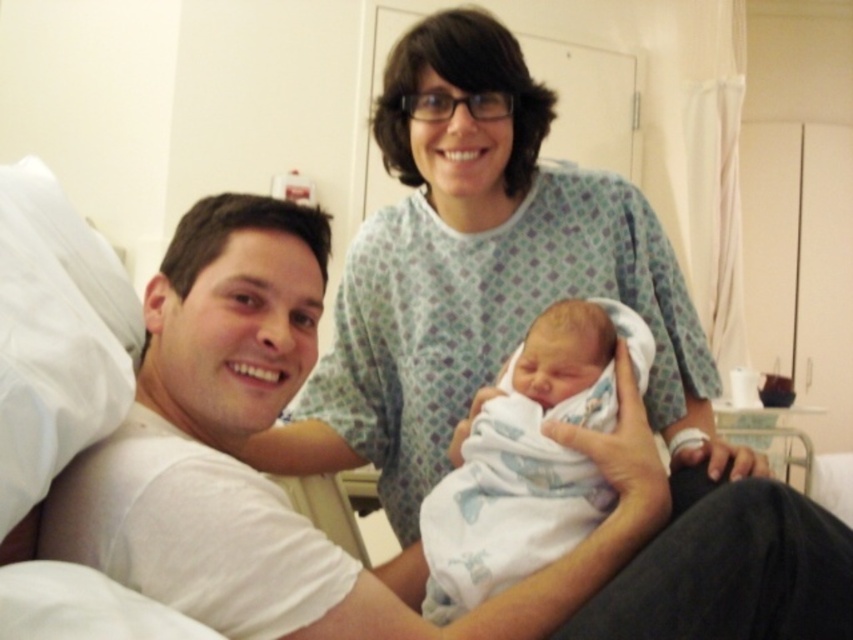
Question: From the image, what is the correct spatial relationship of white printed scrubs at upper center in relation to white swaddled newborn at center?

Choices:
 (A) right
 (B) left

Answer: (B)

Question: Estimate the real-world distances between objects in this image. Which object is closer to the white swaddled newborn at center?

Choices:
 (A) white cotton shirt at center
 (B) white printed scrubs at upper center

Answer: (A)

Question: Is white cotton shirt at center closer to the viewer compared to white swaddled newborn at center?

Choices:
 (A) yes
 (B) no

Answer: (A)

Question: Which of these objects is positioned farthest from the white printed scrubs at upper center?

Choices:
 (A) white cotton shirt at center
 (B) white swaddled newborn at center

Answer: (A)

Question: Among these points, which one is nearest to the camera?

Choices:
 (A) (463, 588)
 (B) (447, 186)
 (C) (137, 452)

Answer: (C)

Question: Is white printed scrubs at upper center further to the viewer compared to white swaddled newborn at center?

Choices:
 (A) yes
 (B) no

Answer: (A)